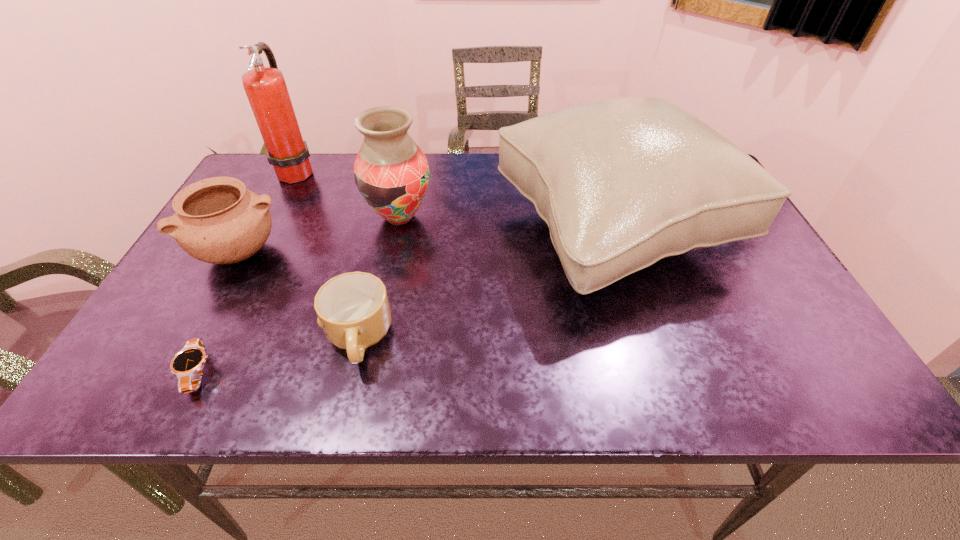
Identify the location of fire extinguisher. (265, 87).

The width and height of the screenshot is (960, 540). What are the coordinates of `the rightmost object` in the screenshot? It's located at (624, 182).

Find the location of a particular element. The width and height of the screenshot is (960, 540). vase is located at coordinates (x=391, y=172).

The height and width of the screenshot is (540, 960). I want to click on the fourth tallest object, so click(x=217, y=220).

Identify the location of the fifth tallest object. (353, 309).

The height and width of the screenshot is (540, 960). What are the coordinates of `watch` in the screenshot? It's located at (187, 364).

Where is `vacant region located at the nozzle of the tallest object`? vacant region located at the nozzle of the tallest object is located at coordinates (422, 171).

Where is `vacant region located on the left of the rightmost object`? The height and width of the screenshot is (540, 960). vacant region located on the left of the rightmost object is located at coordinates (359, 230).

Find the location of `blank area located on the front of the vase`. blank area located on the front of the vase is located at coordinates (386, 281).

Identify the location of free region located on the right of the third shortest object. (312, 253).